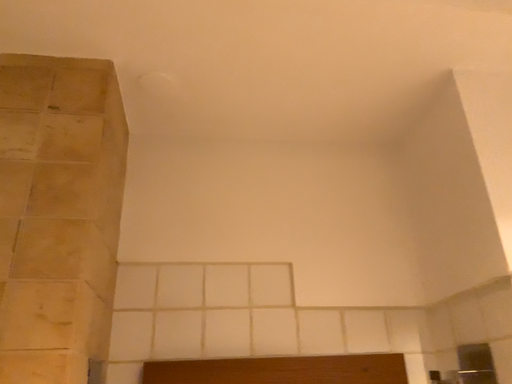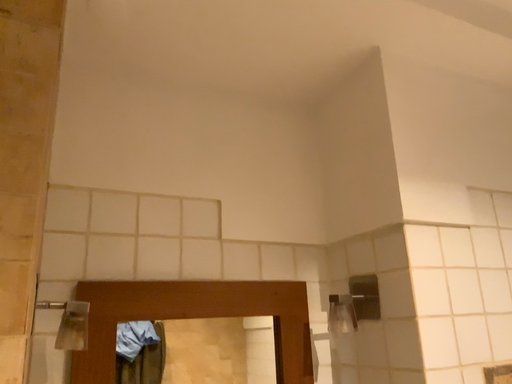
Question: Which way did the camera rotate in the video?

Choices:
 (A) rotated upward
 (B) rotated downward

Answer: (B)